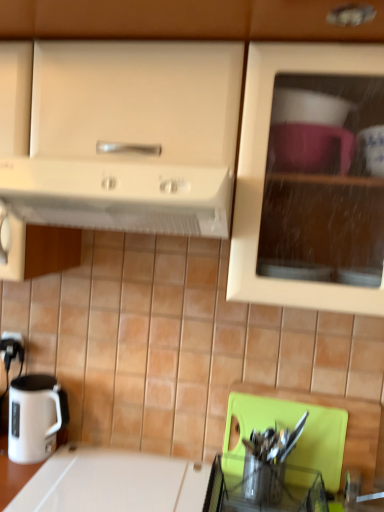
What do you see at coordinates (118, 195) in the screenshot?
I see `white matte range hood at upper center` at bounding box center [118, 195].

Describe the element at coordinates (113, 483) in the screenshot. I see `white glossy countertop at lower left` at that location.

The image size is (384, 512). Describe the element at coordinates (11, 347) in the screenshot. I see `white plastic electric outlet at lower left` at that location.

The image size is (384, 512). What do you see at coordinates (35, 417) in the screenshot?
I see `white glossy electric kettle at lower left` at bounding box center [35, 417].

Where is `white glossy electric kettle at lower left`? The width and height of the screenshot is (384, 512). white glossy electric kettle at lower left is located at coordinates 35,417.

What are the coordinates of `white matte range hood at upper center` in the screenshot? It's located at (118, 195).

Is point (11, 352) less distant than point (303, 66)?

No, (11, 352) is behind (303, 66).

From the image's perspective, is white plastic electric outlet at lower left located above matte white cabinet at upper center?

Actually, white plastic electric outlet at lower left appears below matte white cabinet at upper center in the image.

How many degrees apart are the facing directions of white plastic electric outlet at lower left and matte white cabinet at upper center?

The angular difference between white plastic electric outlet at lower left and matte white cabinet at upper center is 0.157 degrees.

Is white plastic electric outlet at lower left bigger than matte white cabinet at upper center?

Actually, white plastic electric outlet at lower left might be smaller than matte white cabinet at upper center.

Does point (14, 428) come in front of point (16, 352)?

Yes.

Identify the location of electric outlet located above the white glossy electric kettle at lower left (from the image's perspective). (11, 347).

From a real-world perspective, is white glossy electric kettle at lower left over white plastic electric outlet at lower left?

No.

Based on the photo, how different are the orientations of white glossy electric kettle at lower left and white plastic electric outlet at lower left in degrees?

1.72 degrees separate the facing orientations of white glossy electric kettle at lower left and white plastic electric outlet at lower left.

Is white glossy countertop at lower left not close to white glossy electric kettle at lower left?

white glossy countertop at lower left is actually quite close to white glossy electric kettle at lower left.

From the image's perspective, between white glossy countertop at lower left and white glossy electric kettle at lower left, which one is located above?

white glossy electric kettle at lower left, from the image's perspective.

Can you confirm if white glossy countertop at lower left is thinner than white glossy electric kettle at lower left?

Incorrect, the width of white glossy countertop at lower left is not less than that of white glossy electric kettle at lower left.

Consider the image. Is white glossy countertop at lower left oriented away from white glossy electric kettle at lower left?

That's not correct — white glossy countertop at lower left is not looking away from white glossy electric kettle at lower left.

Measure the distance between white glossy electric kettle at lower left and white matte range hood at upper center.

white glossy electric kettle at lower left and white matte range hood at upper center are 71.37 centimeters apart.

Can you tell me how much white glossy electric kettle at lower left and white matte range hood at upper center differ in facing direction?

There is a 1.56-degree angle between the facing directions of white glossy electric kettle at lower left and white matte range hood at upper center.

From the image's perspective, is white glossy electric kettle at lower left below white matte range hood at upper center?

Yes, from the image's perspective, white glossy electric kettle at lower left is below white matte range hood at upper center.

Is white glossy electric kettle at lower left taller or shorter than white matte range hood at upper center?

In the image, white glossy electric kettle at lower left appears to be taller than white matte range hood at upper center.

Considering the positions of objects white matte range hood at upper center and white glossy countertop at lower left in the image provided, who is in front, white matte range hood at upper center or white glossy countertop at lower left?

white matte range hood at upper center is in front.

Between white matte range hood at upper center and white glossy countertop at lower left, which one has smaller width?

white glossy countertop at lower left is thinner.

How different are the orientations of white matte range hood at upper center and white glossy countertop at lower left in degrees?

The facing directions of white matte range hood at upper center and white glossy countertop at lower left are 0.372 degrees apart.

From the image's perspective, which one is positioned higher, white matte range hood at upper center or white glossy electric kettle at lower left?

white matte range hood at upper center appears higher in the image.

Between white matte range hood at upper center and white glossy electric kettle at lower left, which one has more height?

With more height is white glossy electric kettle at lower left.

Does white matte range hood at upper center lie behind white glossy electric kettle at lower left?

No, white matte range hood at upper center is in front of white glossy electric kettle at lower left.

Could you measure the distance between white matte range hood at upper center and white glossy electric kettle at lower left?

white matte range hood at upper center and white glossy electric kettle at lower left are 28.10 inches apart.

Is white plastic electric outlet at lower left taller or shorter than white glossy electric kettle at lower left?

In the image, white plastic electric outlet at lower left appears to be shorter than white glossy electric kettle at lower left.

Based on the photo, who is smaller, white plastic electric outlet at lower left or white glossy electric kettle at lower left?

white plastic electric outlet at lower left.

Is white plastic electric outlet at lower left turned away from white glossy electric kettle at lower left?

white plastic electric outlet at lower left is not turned away from white glossy electric kettle at lower left.

In order to click on cabinetry in front of the white plastic electric outlet at lower left in this screenshot , I will do `click(183, 19)`.

At what (x,y) coordinates should I click in order to perform the action: click on electric outlet that appears above the white glossy electric kettle at lower left (from the image's perspective). Please return your answer as a coordinate pair (x, y). Image resolution: width=384 pixels, height=512 pixels. Looking at the image, I should click on (11, 347).

From the image, which object appears to be farther from white glossy countertop at lower left, matte white cabinet at upper center or white plastic electric outlet at lower left?

matte white cabinet at upper center.

When comparing their distances from white glossy countertop at lower left, does matte white cabinet at upper center or white matte range hood at upper center seem further?

matte white cabinet at upper center is positioned further to the anchor white glossy countertop at lower left.

Considering their positions, is white glossy countertop at lower left positioned further to white plastic electric outlet at lower left than white matte range hood at upper center?

white matte range hood at upper center is positioned further to the anchor white plastic electric outlet at lower left.

Which object lies nearer to the anchor point white glossy countertop at lower left, white plastic electric outlet at lower left or matte white cabinet at upper center?

white plastic electric outlet at lower left is closer to white glossy countertop at lower left.

Looking at the image, which one is located closer to white glossy electric kettle at lower left, white matte range hood at upper center or matte white cabinet at upper center?

Among the two, white matte range hood at upper center is located nearer to white glossy electric kettle at lower left.

Considering their positions, is white glossy countertop at lower left positioned further to matte white cabinet at upper center than white glossy electric kettle at lower left?

white glossy electric kettle at lower left.

Which object lies further to the anchor point white glossy countertop at lower left, white matte range hood at upper center or white glossy electric kettle at lower left?

white matte range hood at upper center.

When comparing their distances from white plastic electric outlet at lower left, does white matte range hood at upper center or white glossy countertop at lower left seem closer?

white glossy countertop at lower left is closer to white plastic electric outlet at lower left.

I want to click on coffee cup between matte white cabinet at upper center and white plastic electric outlet at lower left in the front-back direction, so (35, 417).

Identify the location of electric outlet between matte white cabinet at upper center and white glossy countertop at lower left vertically. (11, 347).

Find the location of a particular element. Image resolution: width=384 pixels, height=512 pixels. kitchen appliance between matte white cabinet at upper center and white glossy countertop at lower left in the up-down direction is located at coordinates (118, 195).

Where is `kitchen appliance between matte white cabinet at upper center and white plastic electric outlet at lower left from front to back`? kitchen appliance between matte white cabinet at upper center and white plastic electric outlet at lower left from front to back is located at coordinates (118, 195).